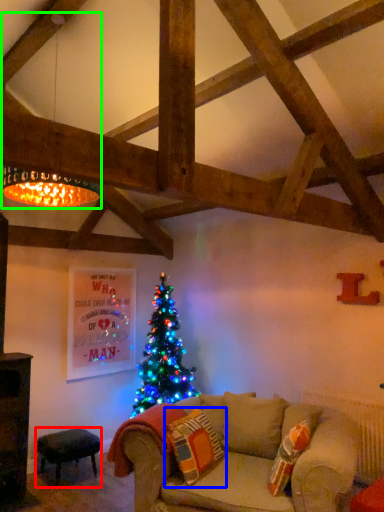
Question: Which object is the farthest from stool (highlighted by a red box)? Choose among these: pillow (highlighted by a blue box) or lamp (highlighted by a green box).

Choices:
 (A) pillow
 (B) lamp

Answer: (B)